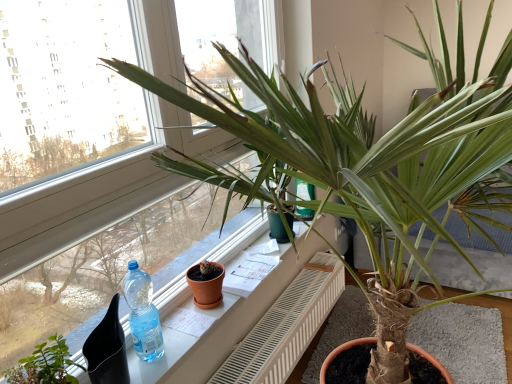
The width and height of the screenshot is (512, 384). Identify the location of vacant space behind transparent plastic bottle at window. (177, 321).